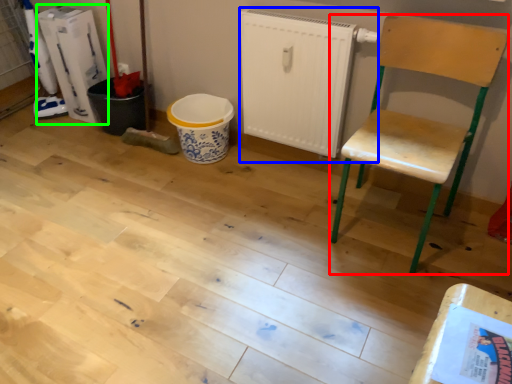
Question: Considering the real-world distances, which object is closest to chair (highlighted by a red box)? radiator (highlighted by a blue box) or appliance (highlighted by a green box).

Choices:
 (A) radiator
 (B) appliance

Answer: (A)